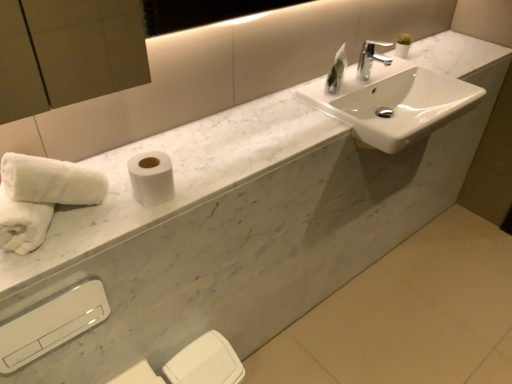
Identify the location of vacant area located to the right-hand side of white fluffy towels at lower left. (99, 221).